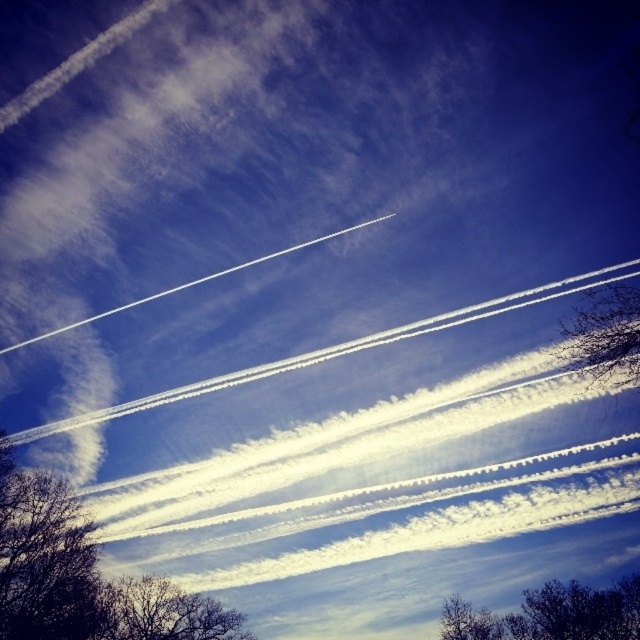
Question: Considering the real-world distances, which object is closest to the silhouette bare tree at bottom left?

Choices:
 (A) bare branches at right
 (B) bare branches at bottom
 (C) dark brown textured tree at lower left

Answer: (C)

Question: Which point appears farthest from the camera in this image?

Choices:
 (A) (541, 589)
 (B) (468, 625)
 (C) (579, 346)

Answer: (B)

Question: Which object appears closest to the camera in this image?

Choices:
 (A) dark brown textured tree at lower left
 (B) bare branches at right
 (C) dark green leafy tree at lower right
 (D) silhouette bare tree at bottom left

Answer: (B)

Question: Does silhouette bare tree at bottom left appear on the left side of bare branches at bottom?

Choices:
 (A) yes
 (B) no

Answer: (A)

Question: Is silhouette bare tree at bottom left closer to the viewer compared to brown textured tree at lower left?

Choices:
 (A) yes
 (B) no

Answer: (A)

Question: Can you confirm if dark brown textured tree at lower left is positioned above brown textured tree at lower left?

Choices:
 (A) yes
 (B) no

Answer: (A)